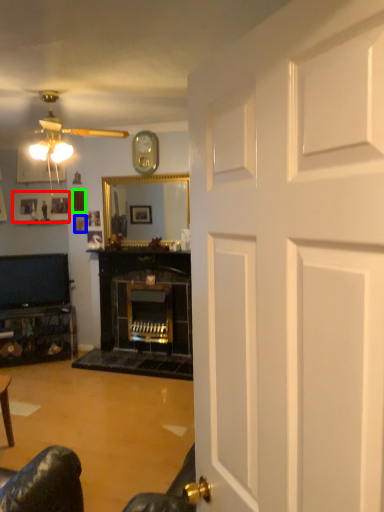
Question: Based on their relative distances, which object is farther from picture frame (highlighted by a red box)? Choose from picture frame (highlighted by a blue box) and picture frame (highlighted by a green box).

Choices:
 (A) picture frame
 (B) picture frame

Answer: (A)